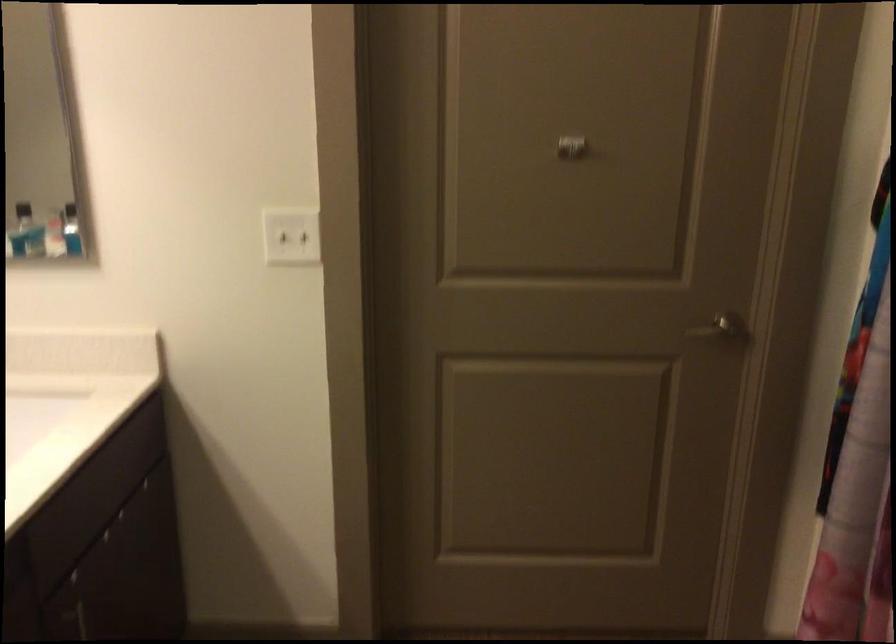
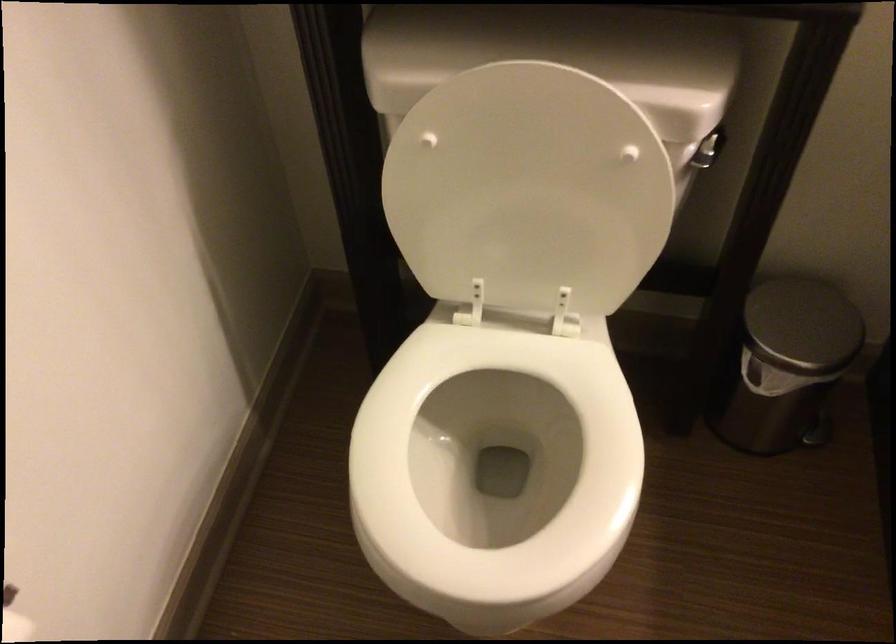
Based on the continuous images, in which direction is the camera rotating?

The camera's rotation is toward left-down.